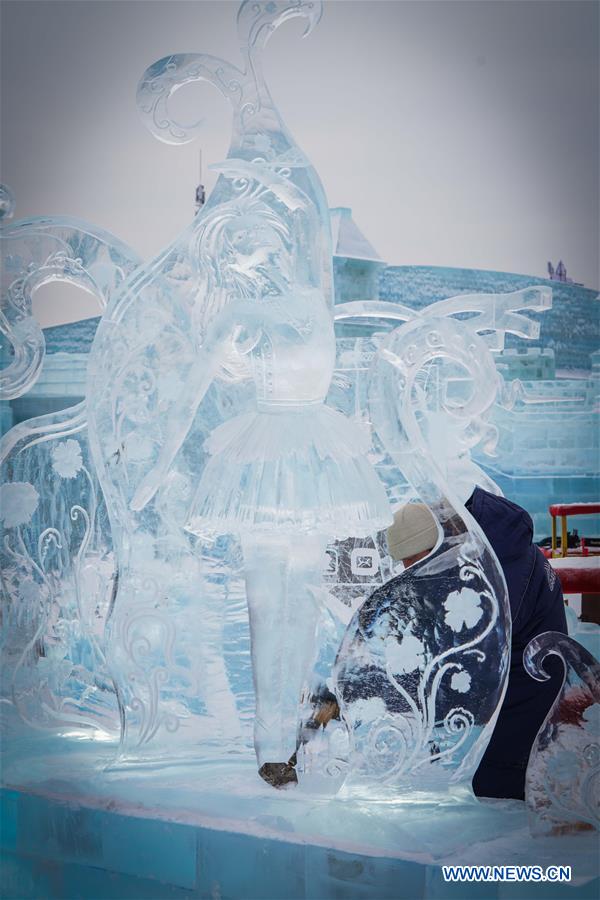
Identify the location of hood. (499, 527).